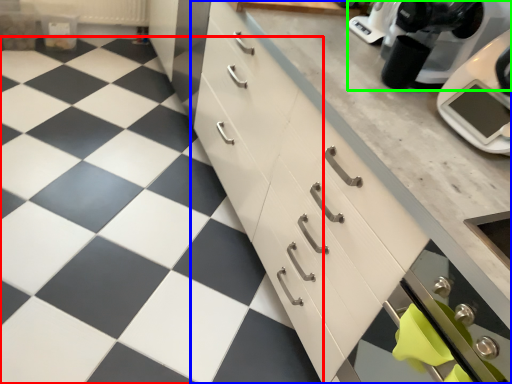
Question: Which object is positioned farthest from tile (highlighted by a red box)? Select from cabinetry (highlighted by a blue box) and kitchen appliance (highlighted by a green box).

Choices:
 (A) cabinetry
 (B) kitchen appliance

Answer: (B)